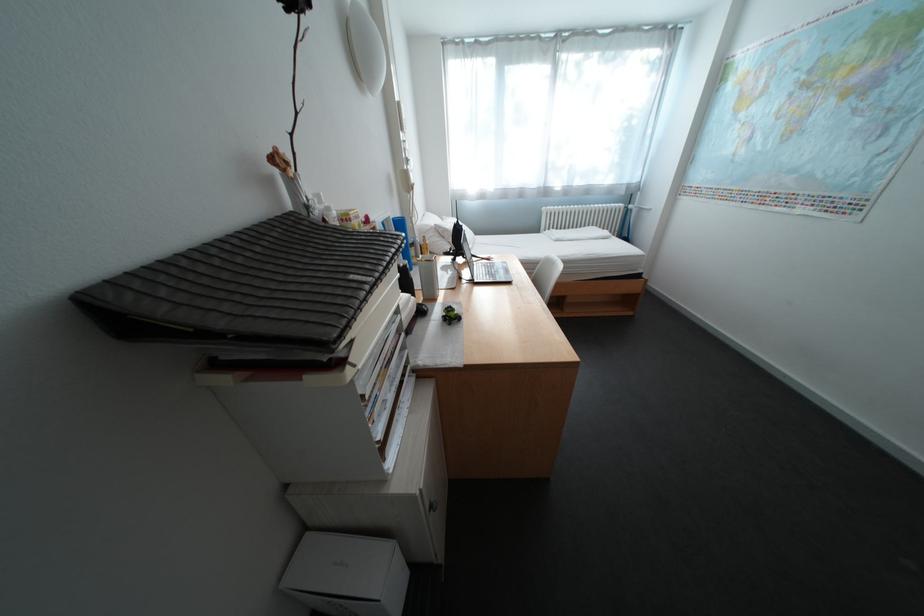
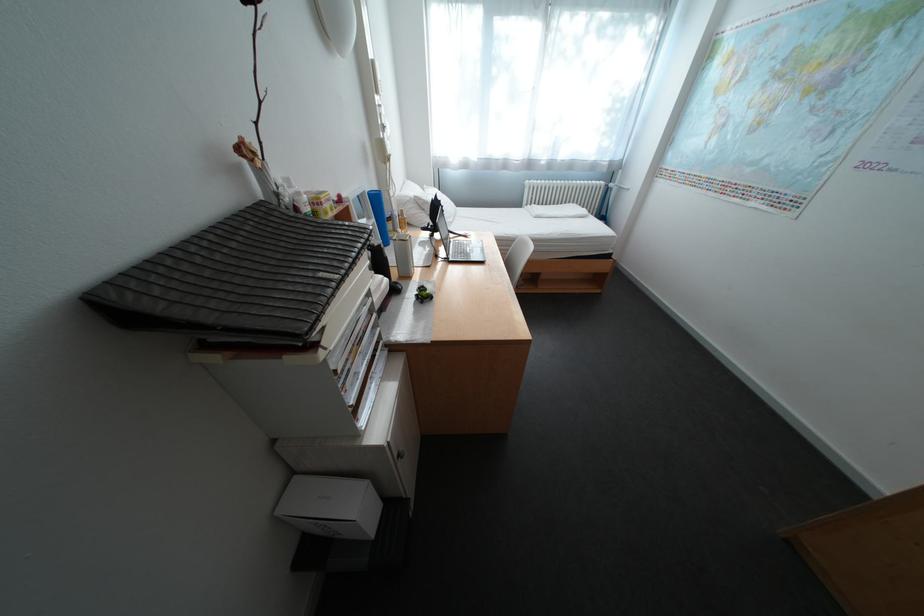
The point at (402,217) is marked in the first image. Where is the corresponding point in the second image?

(378, 192)